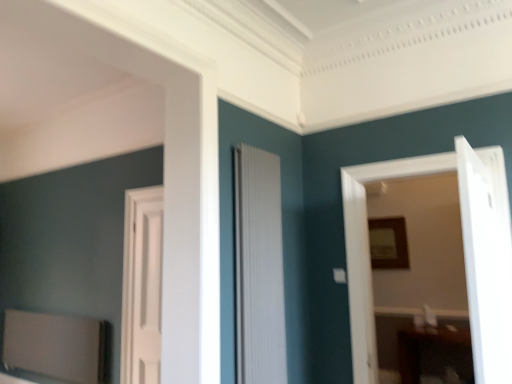
You are a GUI agent. You are given a task and a screenshot of the screen. Output one action in this format:
    pyautogui.click(x=<x>, y=<y>)
    Task: Click on the wooden frame at upper right
    The width and height of the screenshot is (512, 384).
    Given the screenshot: What is the action you would take?
    [388, 243]

This screenshot has height=384, width=512. Describe the element at coordinates (142, 286) in the screenshot. I see `white matte door at center, the first door in the left-to-right sequence` at that location.

The width and height of the screenshot is (512, 384). What do you see at coordinates (486, 259) in the screenshot?
I see `white glossy door at right, arranged as the fourth door when viewed from the left` at bounding box center [486, 259].

The image size is (512, 384). What are the coordinates of `white wooden door at center, which is the 3th door in left-to-right order` in the screenshot? It's located at (464, 255).

What do you see at coordinates (464, 255) in the screenshot? Image resolution: width=512 pixels, height=384 pixels. I see `white wooden door at center, which is the 3th door in left-to-right order` at bounding box center [464, 255].

Find the location of a particular element. The image size is (512, 384). wooden frame at upper right is located at coordinates (388, 243).

Considering the positions of point (501, 300) and point (485, 327), is point (501, 300) closer or farther from the camera than point (485, 327)?

Point (501, 300) appears to be farther away from the viewer than point (485, 327).

Is white wooden door at center, which is the 3th door in left-to-right order, facing away from white glossy door at right, arranged as the fourth door when viewed from the left?

No.

Does white wooden door at center, which is counted as the second door, starting from the right, have a larger size compared to white glossy door at right, marked as the first door in a right-to-left arrangement?

Yes, white wooden door at center, which is counted as the second door, starting from the right, is bigger than white glossy door at right, marked as the first door in a right-to-left arrangement.

Would you say white wooden door at center, which is counted as the second door, starting from the right, contains white glossy door at right, marked as the first door in a right-to-left arrangement?

Definitely not — white glossy door at right, marked as the first door in a right-to-left arrangement, is not inside white wooden door at center, which is counted as the second door, starting from the right.

Considering the relative positions of white ribbed radiator at center, arranged as the 3th door when viewed from the right, and white wooden door at center, which is the 3th door in left-to-right order, in the image provided, is white ribbed radiator at center, arranged as the 3th door when viewed from the right, to the right of white wooden door at center, which is the 3th door in left-to-right order, from the viewer's perspective?

No, white ribbed radiator at center, arranged as the 3th door when viewed from the right, is not to the right of white wooden door at center, which is the 3th door in left-to-right order.

From the image's perspective, which one is positioned lower, white ribbed radiator at center, the 2th door when ordered from left to right, or white wooden door at center, which is counted as the second door, starting from the right?

white wooden door at center, which is counted as the second door, starting from the right, is shown below in the image.

Where is `the 1st door behind when counting from the white ribbed radiator at center, arranged as the 3th door when viewed from the right`? the 1st door behind when counting from the white ribbed radiator at center, arranged as the 3th door when viewed from the right is located at coordinates (464, 255).

Does white ribbed radiator at center, arranged as the 3th door when viewed from the right, have a greater height compared to white wooden door at center, which is the 3th door in left-to-right order?

In fact, white ribbed radiator at center, arranged as the 3th door when viewed from the right, may be shorter than white wooden door at center, which is the 3th door in left-to-right order.

Between white ribbed radiator at center, arranged as the 3th door when viewed from the right, and wooden frame at upper right, which one has larger size?

white ribbed radiator at center, arranged as the 3th door when viewed from the right, is bigger.

Could you tell me if white ribbed radiator at center, arranged as the 3th door when viewed from the right, is turned towards wooden frame at upper right?

No, white ribbed radiator at center, arranged as the 3th door when viewed from the right, is not turned towards wooden frame at upper right.

Can you confirm if white ribbed radiator at center, the 2th door when ordered from left to right, is taller than wooden frame at upper right?

Yes.

Looking at this image, does white ribbed radiator at center, arranged as the 3th door when viewed from the right, lie in front of wooden frame at upper right?

Yes, white ribbed radiator at center, arranged as the 3th door when viewed from the right, is in front of wooden frame at upper right.

Can you confirm if white matte door at center, the 4th door positioned from the right, is thinner than white wooden door at center, which is counted as the second door, starting from the right?

Indeed, white matte door at center, the 4th door positioned from the right, has a lesser width compared to white wooden door at center, which is counted as the second door, starting from the right.

Is white matte door at center, the 4th door positioned from the right, positioned with its back to white wooden door at center, which is counted as the second door, starting from the right?

No, white wooden door at center, which is counted as the second door, starting from the right, is not at the back of white matte door at center, the 4th door positioned from the right.

Considering the sizes of objects white matte door at center, the first door in the left-to-right sequence, and white wooden door at center, which is the 3th door in left-to-right order, in the image provided, who is shorter, white matte door at center, the first door in the left-to-right sequence, or white wooden door at center, which is the 3th door in left-to-right order,?

With less height is white wooden door at center, which is the 3th door in left-to-right order.

Considering the relative positions of white matte door at center, the 4th door positioned from the right, and white wooden door at center, which is the 3th door in left-to-right order, in the image provided, is white matte door at center, the 4th door positioned from the right, to the right of white wooden door at center, which is the 3th door in left-to-right order, from the viewer's perspective?

No.

Can you confirm if wooden frame at upper right is smaller than white matte door at center, the first door in the left-to-right sequence?

Yes.

From the image's perspective, which object appears higher, wooden frame at upper right or white matte door at center, the 4th door positioned from the right?

wooden frame at upper right, from the image's perspective.

Which is closer to the camera, (375, 265) or (138, 321)?

The point (138, 321) is in front.

How distant is wooden frame at upper right from white matte door at center, the 4th door positioned from the right?

A distance of 8.32 feet exists between wooden frame at upper right and white matte door at center, the 4th door positioned from the right.

Which is correct: white ribbed radiator at center, arranged as the 3th door when viewed from the right, is inside white glossy door at right, marked as the first door in a right-to-left arrangement, or outside of it?

white ribbed radiator at center, arranged as the 3th door when viewed from the right, is outside white glossy door at right, marked as the first door in a right-to-left arrangement.

Looking at this image, how much distance is there between white ribbed radiator at center, the 2th door when ordered from left to right, and white glossy door at right, marked as the first door in a right-to-left arrangement?

The distance of white ribbed radiator at center, the 2th door when ordered from left to right, from white glossy door at right, marked as the first door in a right-to-left arrangement, is 4.11 feet.

Is there a large distance between white ribbed radiator at center, arranged as the 3th door when viewed from the right, and white glossy door at right, marked as the first door in a right-to-left arrangement?

Yes.

From the white ribbed radiator at center, arranged as the 3th door when viewed from the right, count 2nd door to the right and point to it. Please provide its 2D coordinates.

[(486, 259)]

Between white wooden door at center, which is the 3th door in left-to-right order, and white ribbed radiator at center, the 2th door when ordered from left to right, which one appears on the left side from the viewer's perspective?

white ribbed radiator at center, the 2th door when ordered from left to right, is more to the left.

You are a GUI agent. You are given a task and a screenshot of the screen. Output one action in this format:
    pyautogui.click(x=<x>, y=<y>)
    Task: Click on the 1st door in front when counting from the white wooden door at center, which is counted as the second door, starting from the right
    
    Given the screenshot: What is the action you would take?
    pyautogui.click(x=259, y=268)

Is white wooden door at center, which is counted as the second door, starting from the right, closer to the viewer compared to white ribbed radiator at center, arranged as the 3th door when viewed from the right?

No, white wooden door at center, which is counted as the second door, starting from the right, is further to the viewer.

From a real-world perspective, is white wooden door at center, which is counted as the second door, starting from the right, positioned over white ribbed radiator at center, the 2th door when ordered from left to right, based on gravity?

No, from a real-world perspective, white wooden door at center, which is counted as the second door, starting from the right, is not on top of white ribbed radiator at center, the 2th door when ordered from left to right.

I want to click on the 2nd door in front of the white wooden door at center, which is the 3th door in left-to-right order, counting from the anchor's position, so click(486, 259).

This screenshot has width=512, height=384. I want to click on the 1st door above the white wooden door at center, which is counted as the second door, starting from the right (from the image's perspective), so click(x=259, y=268).

Which object lies nearer to the anchor point white matte door at center, the first door in the left-to-right sequence, white ribbed radiator at center, arranged as the 3th door when viewed from the right, or wooden frame at upper right?

The object closer to white matte door at center, the first door in the left-to-right sequence, is white ribbed radiator at center, arranged as the 3th door when viewed from the right.

From the image, which object appears to be nearer to white ribbed radiator at center, arranged as the 3th door when viewed from the right, white glossy door at right, arranged as the fourth door when viewed from the left, or white matte door at center, the first door in the left-to-right sequence?

white glossy door at right, arranged as the fourth door when viewed from the left.

Considering their positions, is white ribbed radiator at center, the 2th door when ordered from left to right, positioned closer to wooden frame at upper right than white matte door at center, the 4th door positioned from the right?

Based on the image, white ribbed radiator at center, the 2th door when ordered from left to right, appears to be nearer to wooden frame at upper right.

When comparing their distances from wooden frame at upper right, does white ribbed radiator at center, arranged as the 3th door when viewed from the right, or white wooden door at center, which is counted as the second door, starting from the right, seem further?

Based on the image, white ribbed radiator at center, arranged as the 3th door when viewed from the right, appears to be further to wooden frame at upper right.

Based on their spatial positions, is white glossy door at right, marked as the first door in a right-to-left arrangement, or wooden frame at upper right further from white matte door at center, the first door in the left-to-right sequence?

white glossy door at right, marked as the first door in a right-to-left arrangement.

Based on the photo, considering their positions, is white matte door at center, the 4th door positioned from the right, positioned further to white glossy door at right, arranged as the fourth door when viewed from the left, than white wooden door at center, which is the 3th door in left-to-right order?

Based on the image, white matte door at center, the 4th door positioned from the right, appears to be further to white glossy door at right, arranged as the fourth door when viewed from the left.

Considering their positions, is white wooden door at center, which is counted as the second door, starting from the right, positioned further to white glossy door at right, arranged as the fourth door when viewed from the left, than white ribbed radiator at center, arranged as the 3th door when viewed from the right?

white ribbed radiator at center, arranged as the 3th door when viewed from the right, is further to white glossy door at right, arranged as the fourth door when viewed from the left.

Considering their positions, is white wooden door at center, which is the 3th door in left-to-right order, positioned closer to white matte door at center, the 4th door positioned from the right, than white ribbed radiator at center, the 2th door when ordered from left to right?

The object closer to white matte door at center, the 4th door positioned from the right, is white ribbed radiator at center, the 2th door when ordered from left to right.

You are a GUI agent. You are given a task and a screenshot of the screen. Output one action in this format:
    pyautogui.click(x=<x>, y=<y>)
    Task: Click on the door between white matte door at center, the 4th door positioned from the right, and white wooden door at center, which is counted as the second door, starting from the right
    Image resolution: width=512 pixels, height=384 pixels.
    Given the screenshot: What is the action you would take?
    pyautogui.click(x=259, y=268)

This screenshot has height=384, width=512. In order to click on door between white ribbed radiator at center, arranged as the 3th door when viewed from the right, and white glossy door at right, arranged as the fourth door when viewed from the left, in the horizontal direction in this screenshot , I will do `click(464, 255)`.